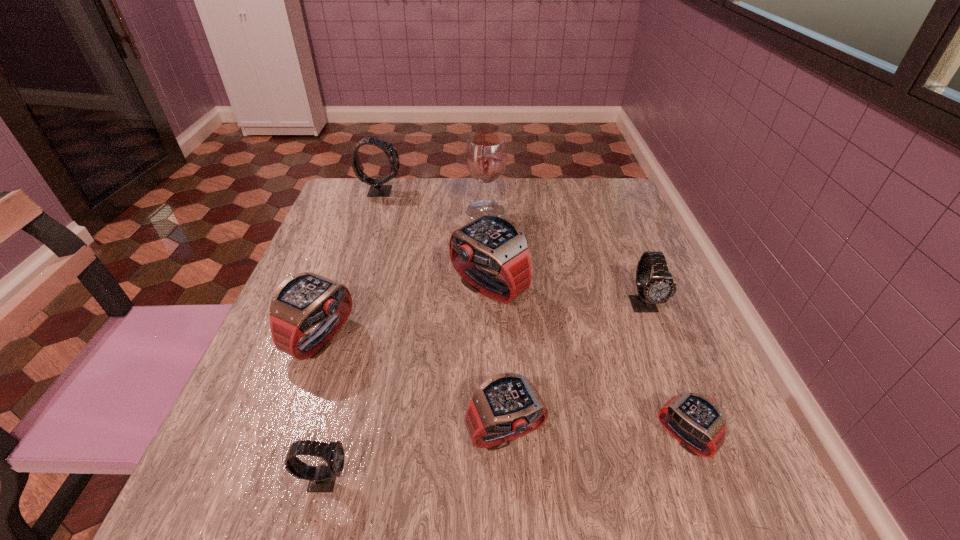
Where is `the smallest red watch`? This screenshot has height=540, width=960. the smallest red watch is located at coordinates (695, 421).

You are a GUI agent. You are given a task and a screenshot of the screen. Output one action in this format:
    pyautogui.click(x=<x>, y=<y>)
    Task: Click on the shortest watch
    This screenshot has height=540, width=960.
    Given the screenshot: What is the action you would take?
    pyautogui.click(x=695, y=421)

This screenshot has height=540, width=960. Identify the location of free space located on the left of the wineglass. (335, 212).

Identify the location of vacant position located on the face of the farthest gray watch. The width and height of the screenshot is (960, 540). (423, 191).

The width and height of the screenshot is (960, 540). I want to click on vacant area situated 0.110m on the left of the biggest red watch, so click(x=397, y=287).

Identify the location of vacant region located on the right of the leftmost red watch. (497, 338).

The image size is (960, 540). I want to click on vacant space located 0.270m on the face of the second smallest gray watch, so click(705, 456).

In order to click on vacant position located on the right of the second smallest red watch in this screenshot , I will do `click(735, 435)`.

The width and height of the screenshot is (960, 540). Find the location of `free space located 0.230m on the face of the smallest gray watch`. free space located 0.230m on the face of the smallest gray watch is located at coordinates (512, 478).

You are a GUI agent. You are given a task and a screenshot of the screen. Output one action in this format:
    pyautogui.click(x=<x>, y=<y>)
    Task: Click on the vacant space located on the left of the shortest object
    This screenshot has width=960, height=540.
    Given the screenshot: What is the action you would take?
    554,438